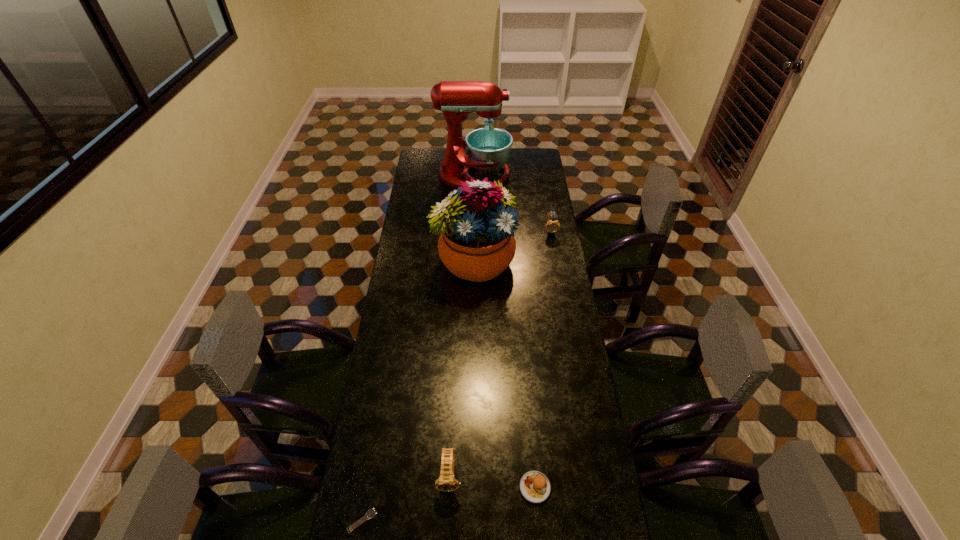
Locate an element on the screen. free space at the far edge is located at coordinates coord(507,164).

Where is `vacant point at the left edge`? vacant point at the left edge is located at coordinates (378, 401).

In the image, there is a desktop. Identify the location of vacant space at the right edge. This screenshot has width=960, height=540. (560, 376).

At what (x,y) coordinates should I click in order to perform the action: click on free space at the far left corner. Please return your answer as a coordinate pair (x, y). The width and height of the screenshot is (960, 540). Looking at the image, I should click on (428, 170).

Identify the location of vacant point at the far right corner. Image resolution: width=960 pixels, height=540 pixels. (517, 154).

This screenshot has width=960, height=540. I want to click on empty space that is in between the fifth shortest object and the second shortest object, so [505, 374].

Where is `vacant area that lies between the second farthest watch and the farthest object`? This screenshot has height=540, width=960. vacant area that lies between the second farthest watch and the farthest object is located at coordinates (462, 326).

Find the location of `free space that is in between the second nearest watch and the fifth tallest object`. free space that is in between the second nearest watch and the fifth tallest object is located at coordinates (492, 481).

This screenshot has height=540, width=960. Find the location of `vacant region between the fifth shortest object and the patty`. vacant region between the fifth shortest object and the patty is located at coordinates (505, 374).

Locate an element on the screen. The image size is (960, 540). empty space between the mixer and the second watch from right to left is located at coordinates (462, 326).